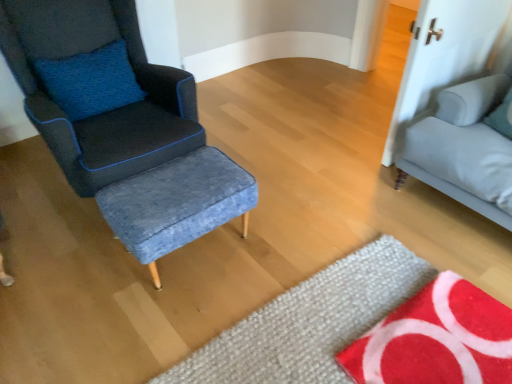
This screenshot has height=384, width=512. In order to click on vacant region below textured wool mat at lower center, positioned as the 2th mat in right-to-left order (from a real-world perspective) in this screenshot , I will do `click(326, 328)`.